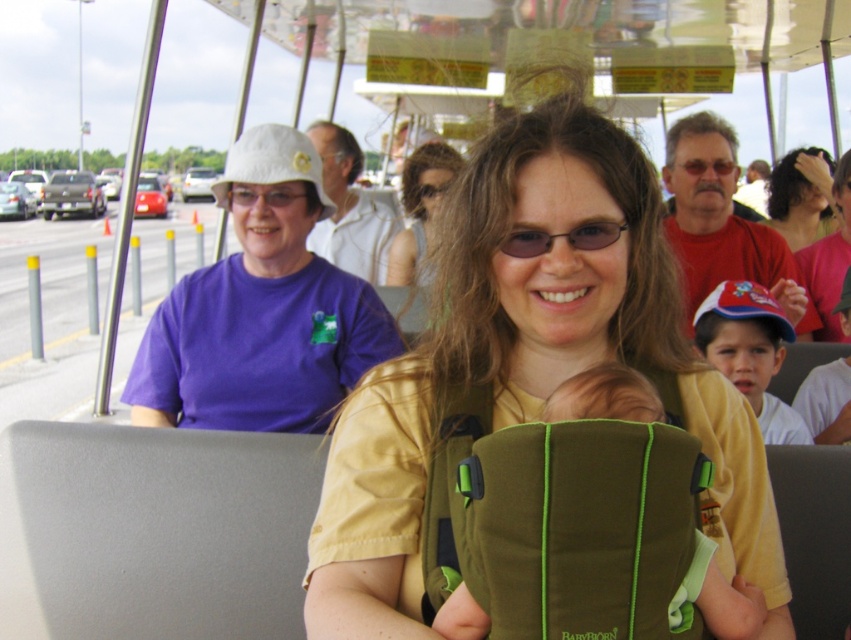
Is white fabric coach at upper center below curly brown hair at upper right?

Yes, white fabric coach at upper center is below curly brown hair at upper right.

Can you confirm if white fabric coach at upper center is taller than curly brown hair at upper right?

→ Yes, white fabric coach at upper center is taller than curly brown hair at upper right.

You are a GUI agent. You are given a task and a screenshot of the screen. Output one action in this format:
    pyautogui.click(x=<x>, y=<y>)
    Task: Click on the white fabric coach at upper center
    The width and height of the screenshot is (851, 640).
    Given the screenshot: What is the action you would take?
    [349, 209]

The width and height of the screenshot is (851, 640). Find the location of `white fabric coach at upper center`. white fabric coach at upper center is located at coordinates (349, 209).

Does point (269, 328) lie in front of point (368, 225)?

Yes, it is.

Is purple cotton shirt at upper left thinner than white fabric coach at upper center?

No.

Is point (260, 225) positioned after point (310, 241)?

No, (260, 225) is closer to viewer.

At what (x,y) coordinates should I click in order to perform the action: click on purple cotton shirt at upper left. Please return your answer as a coordinate pair (x, y). Looking at the image, I should click on (261, 308).

Is matte yellow shirt at center in front of matte purple shirt at upper left?

Yes.

Image resolution: width=851 pixels, height=640 pixels. What do you see at coordinates (528, 365) in the screenshot? I see `matte yellow shirt at center` at bounding box center [528, 365].

At what (x,y) coordinates should I click in order to perform the action: click on matte yellow shirt at center. Please return your answer as a coordinate pair (x, y). This screenshot has width=851, height=640. Looking at the image, I should click on (528, 365).